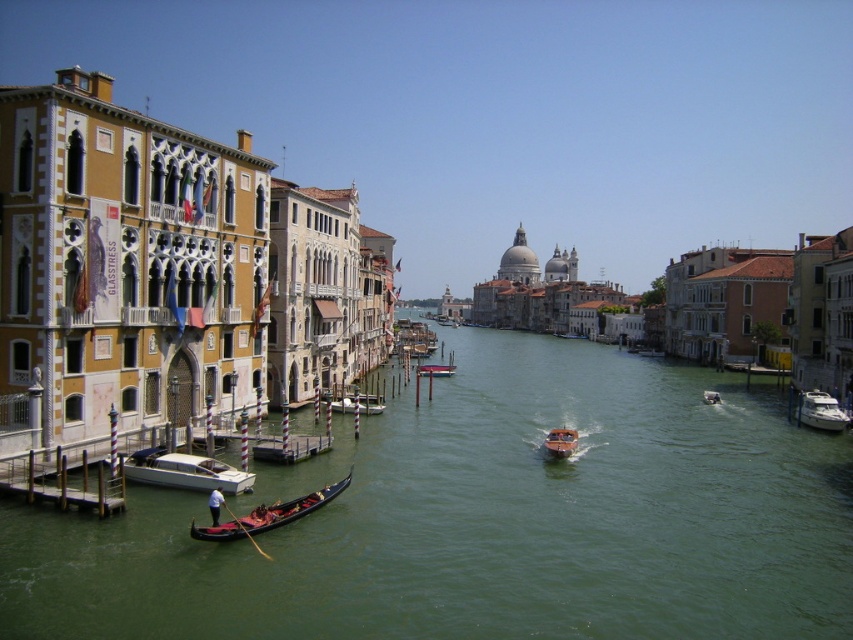
Can you confirm if green water at center is smaller than white glossy yacht at center-right?

Incorrect, green water at center is not smaller in size than white glossy yacht at center-right.

Consider the image. Does green water at center have a lesser width compared to white glossy yacht at center-right?

In fact, green water at center might be wider than white glossy yacht at center-right.

Where is `green water at center`? The width and height of the screenshot is (853, 640). green water at center is located at coordinates (486, 518).

Between green water at center and white glossy boat at center, which one is positioned higher?

white glossy boat at center is higher up.

Which is behind, point (845, 445) or point (372, 396)?

Positioned behind is point (372, 396).

You are a GUI agent. You are given a task and a screenshot of the screen. Output one action in this format:
    pyautogui.click(x=<x>, y=<y>)
    Task: Click on the green water at center
    
    Given the screenshot: What is the action you would take?
    pyautogui.click(x=486, y=518)

What do you see at coordinates (184, 472) in the screenshot? I see `white glossy motorboat at lower left` at bounding box center [184, 472].

Between white glossy motorboat at lower left and white glossy yacht at center-right, which one has less height?

white glossy motorboat at lower left

Between point (190, 480) and point (798, 408), which one is positioned behind?

The point (798, 408) is behind.

Locate an element on the screen. white glossy motorboat at lower left is located at coordinates (184, 472).